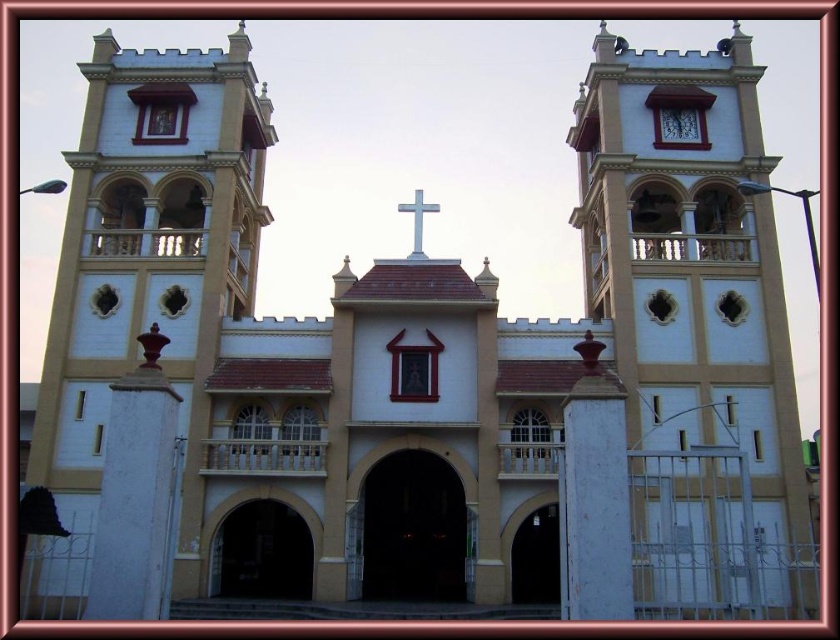
Does matte white tower at center appear over matte yellow tower at center?

Actually, matte white tower at center is below matte yellow tower at center.

Who is shorter, matte white tower at center or matte yellow tower at center?

Standing shorter between the two is matte yellow tower at center.

Does point (683, 435) lie behind point (234, 67)?

No, it is not.

In order to click on matte white tower at center in this screenshot , I will do `click(696, 332)`.

Is point (699, 116) positioned behind point (420, 232)?

Yes, it is.

From the picture: How distant is matte white clock at upper center from white matte cross at center?

matte white clock at upper center and white matte cross at center are 22.55 meters apart from each other.

Identify the location of matte white clock at upper center. (680, 125).

Does matte yellow tower at center lie in front of white matte cross at center?

Yes, it is in front of white matte cross at center.

Is point (56, 412) farther from camera compared to point (416, 252)?

No.

Which is behind, point (213, 128) or point (418, 253)?

Point (213, 128)

Where is `matte yellow tower at center`? This screenshot has height=640, width=840. matte yellow tower at center is located at coordinates (143, 280).